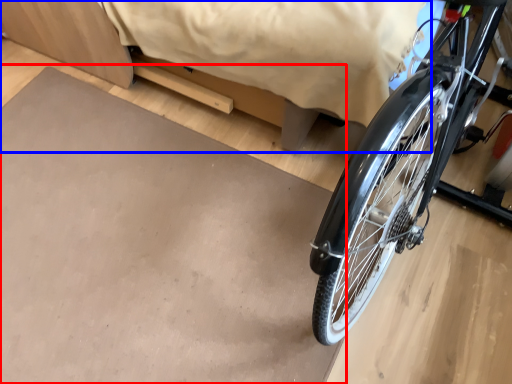
Question: Which point is closer to the camera, slate (highlighted by a red box) or bed (highlighted by a blue box)?

Choices:
 (A) slate
 (B) bed

Answer: (B)